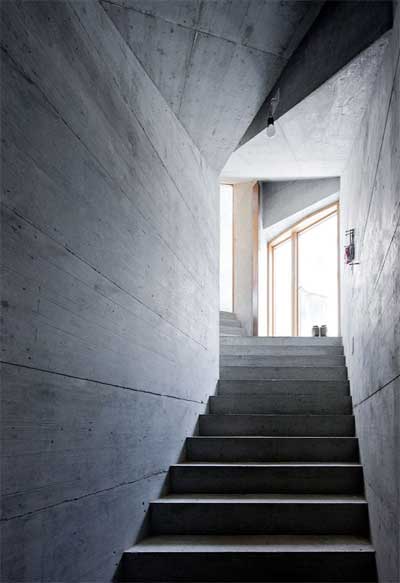
At what (x,y) coordinates should I click in order to perform the action: click on wall on right. Please return your answer as a coordinate pair (x, y). The height and width of the screenshot is (583, 400). Looking at the image, I should click on (372, 314).